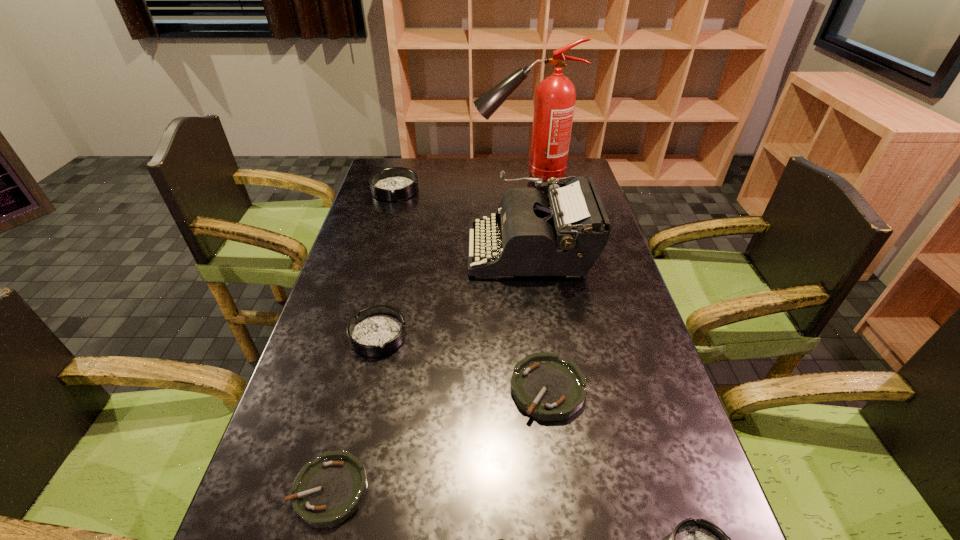
This screenshot has height=540, width=960. What are the coordinates of `free spot at the right edge of the desktop` in the screenshot? It's located at (598, 342).

This screenshot has width=960, height=540. Identify the location of free space between the fifth nearest object and the fire extinguisher. (451, 256).

The height and width of the screenshot is (540, 960). In order to click on vacant space in between the typewriter and the fourth nearest object in this screenshot , I will do pos(540,319).

This screenshot has width=960, height=540. Find the location of `free spot between the third tallest object and the fifth farthest object`. free spot between the third tallest object and the fifth farthest object is located at coordinates (471, 289).

Locate an element on the screen. The width and height of the screenshot is (960, 540). free space that is in between the typewriter and the fourth nearest ashtray is located at coordinates (540, 319).

Locate an element on the screen. The height and width of the screenshot is (540, 960). free space between the biggest green ashtray and the third farthest object is located at coordinates (540, 319).

Locate an element on the screen. The image size is (960, 540). empty space that is in between the second tallest object and the second shortest object is located at coordinates (430, 370).

Locate an element on the screen. This screenshot has width=960, height=540. free space between the sixth shortest object and the red fire extinguisher is located at coordinates (460, 184).

Where is `object identified as the sixth closest to the seventh shortest object`? The width and height of the screenshot is (960, 540). object identified as the sixth closest to the seventh shortest object is located at coordinates (693, 539).

Locate which object is the closest to the nearest green ashtray. Please provide its 2D coordinates. Your answer should be formatted as a tuple, i.e. [(x, y)], where the tuple contains the x and y coordinates of a point satisfying the conditions above.

[(328, 490)]